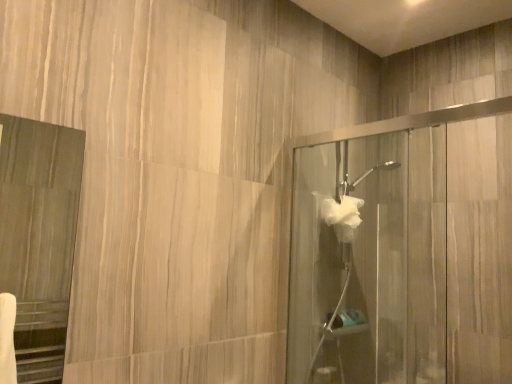
Question: Considering the positions of point (394, 345) and point (356, 218), is point (394, 345) closer or farther from the camera than point (356, 218)?

Choices:
 (A) closer
 (B) farther

Answer: (B)

Question: Visually, is clear glass shower door at right, acting as the second screen door starting from the front, positioned to the left or to the right of white fluffy hand towel at center-right?

Choices:
 (A) left
 (B) right

Answer: (B)

Question: Estimate the real-world distances between objects in this image. Which object is closer to the matte wood mirror at left, which is the 1th screen door in front-to-back order?

Choices:
 (A) white fluffy hand towel at center-right
 (B) clear glass shower door at right, the 1th screen door in the right-to-left sequence

Answer: (B)

Question: Which object is positioned closest to the clear glass shower door at right, which is the 1th screen door in back-to-front order?

Choices:
 (A) white fluffy hand towel at center-right
 (B) matte wood mirror at left, which is the 2th screen door from right to left

Answer: (A)